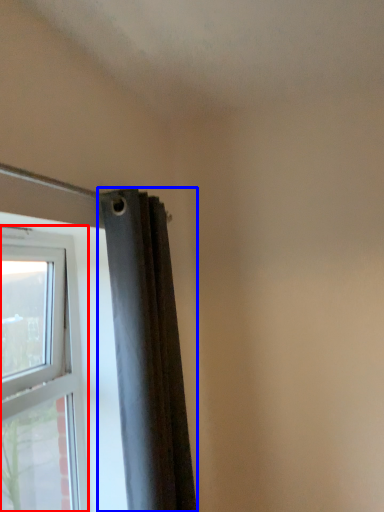
Question: Among these objects, which one is farthest to the camera, window (highlighted by a red box) or curtain (highlighted by a blue box)?

Choices:
 (A) window
 (B) curtain

Answer: (B)